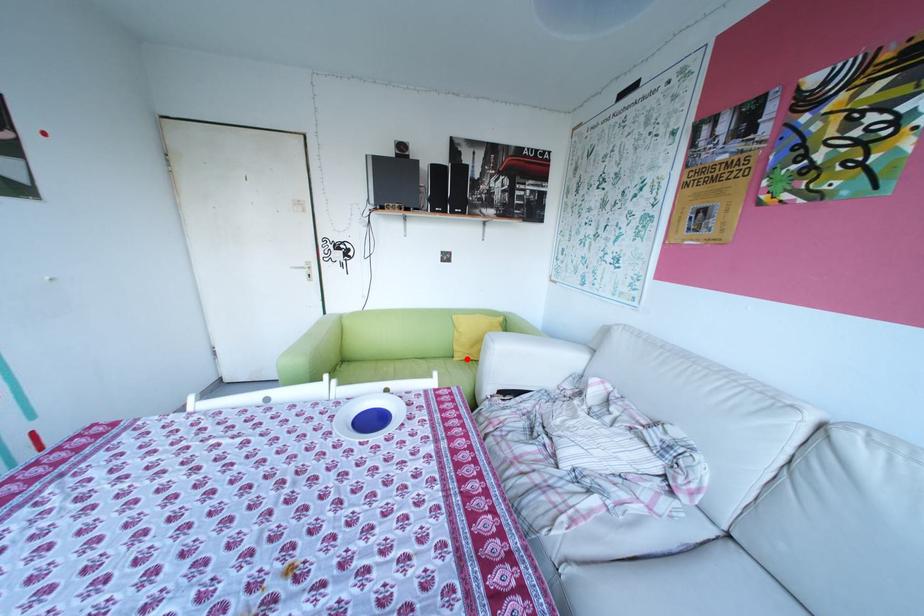
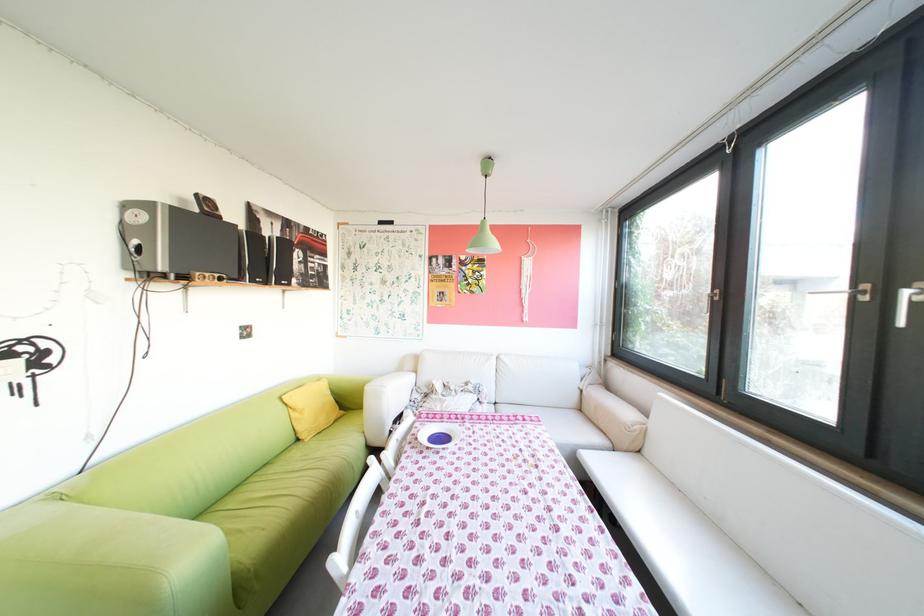
Locate, in the second image, the point that corresponds to the highlighted location in the first image.

(321, 440)